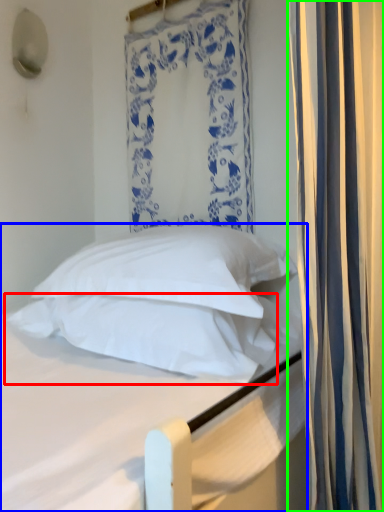
Question: Which object is positioned farthest from pillow (highlighted by a red box)? Select from bed (highlighted by a blue box) and curtain (highlighted by a green box).

Choices:
 (A) bed
 (B) curtain

Answer: (B)